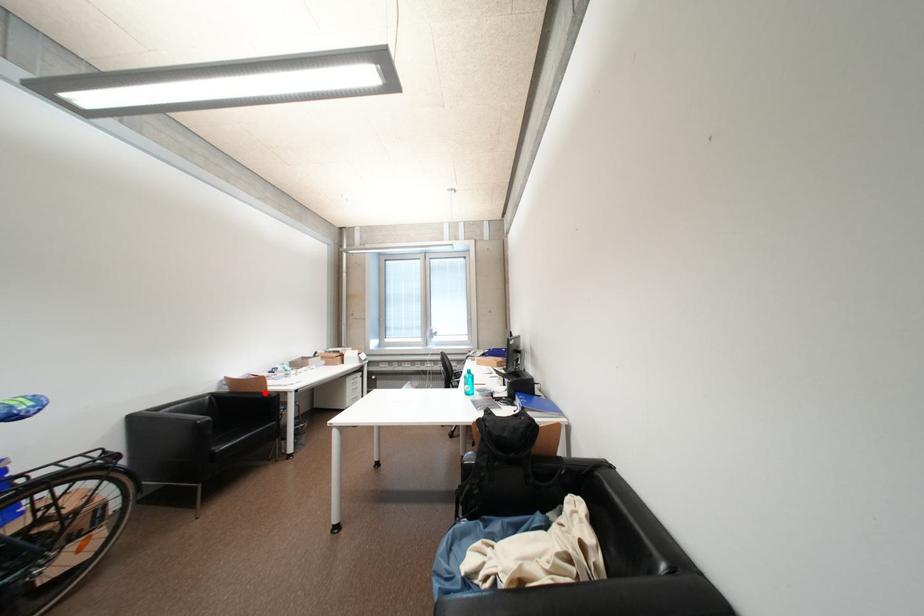
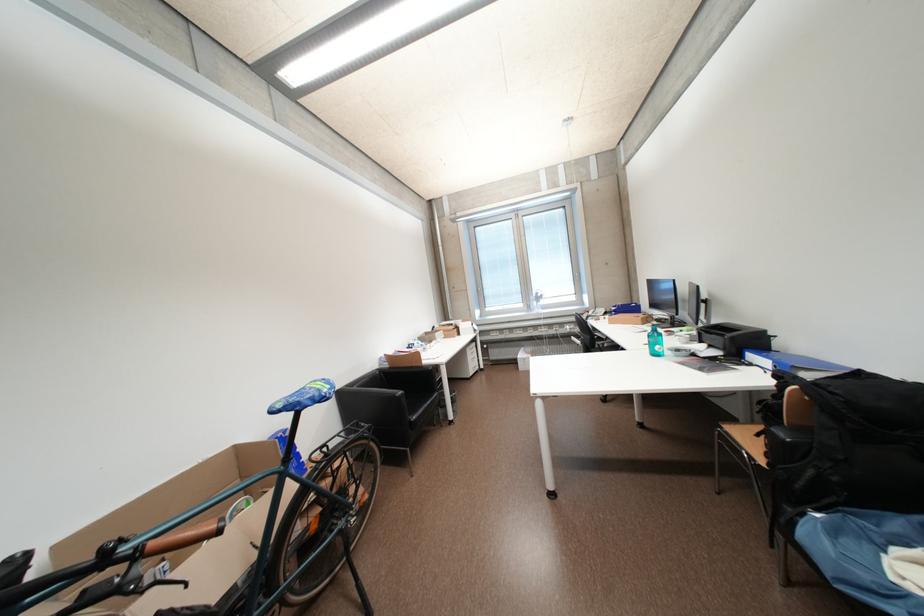
Locate, in the second image, the point that corresponds to the highlighted location in the first image.

(421, 367)